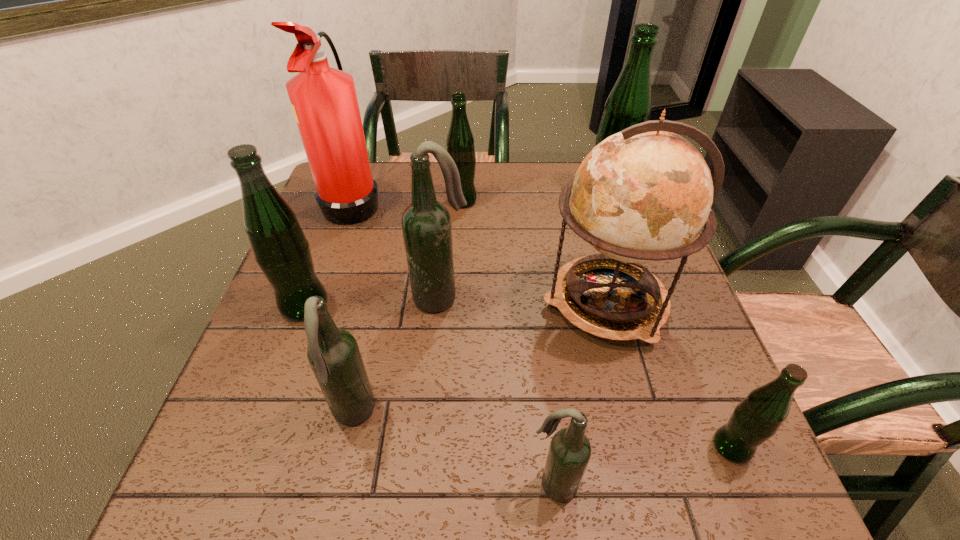
In order to click on object that is positioned at the near right corner in this screenshot , I will do tap(757, 417).

You are a GUI agent. You are given a task and a screenshot of the screen. Output one action in this format:
    pyautogui.click(x=<x>, y=<y>)
    Task: Click on the vacant space at the far edge
    Image resolution: width=960 pixels, height=540 pixels.
    Given the screenshot: What is the action you would take?
    pyautogui.click(x=492, y=192)

You are a GUI agent. You are given a task and a screenshot of the screen. Output one action in this format:
    pyautogui.click(x=<x>, y=<y>)
    Task: Click on the blank space at the near edge of the desktop
    This screenshot has width=960, height=540.
    Given the screenshot: What is the action you would take?
    pyautogui.click(x=471, y=508)

The width and height of the screenshot is (960, 540). In the image, there is a desktop. Find the location of `blank space at the right edge`. blank space at the right edge is located at coordinates tap(680, 441).

The height and width of the screenshot is (540, 960). Find the location of `vacant space at the near left corner`. vacant space at the near left corner is located at coordinates (226, 495).

Identify the location of vacant space at the far right corner. The image size is (960, 540). (582, 163).

Where is `free spot between the nearest green beer bottle and the second dark beer bottle from right to left`? The width and height of the screenshot is (960, 540). free spot between the nearest green beer bottle and the second dark beer bottle from right to left is located at coordinates (587, 373).

Where is `vacant area that lies between the second farthest dark beer bottle and the nearest dark beer bottle`? The height and width of the screenshot is (540, 960). vacant area that lies between the second farthest dark beer bottle and the nearest dark beer bottle is located at coordinates (453, 450).

Where is `empty space that is in between the smallest green beer bottle and the fire extinguisher`? This screenshot has width=960, height=540. empty space that is in between the smallest green beer bottle and the fire extinguisher is located at coordinates (542, 324).

The width and height of the screenshot is (960, 540). Identify the location of free space that is in between the seventh object from right to left and the fire extinguisher. (353, 308).